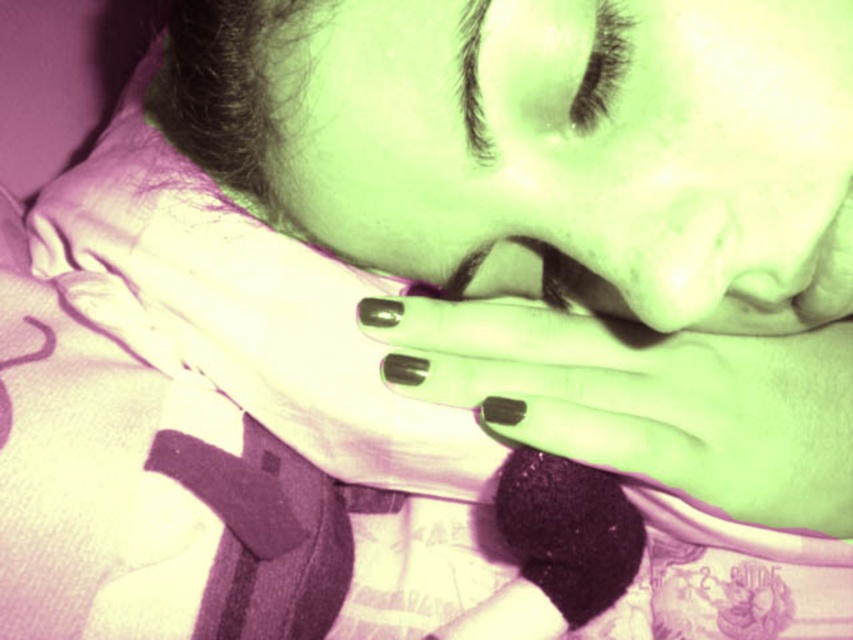
You are a photographer adjusting the lighting in the scene. You need to ensure that the matte green skin at center is properly lit. Where should you position your light source relative to the person?

The matte green skin at center is located at point [584,147], so position the light source at that coordinate to ensure proper lighting.

You are designing a small sculpture that needs to fit between the matte green skin at center and the matte black nails at center. The sculpture is 3 inches long. Will it fit in the space between them?

The space between the matte green skin at center and the matte black nails at center is only 2.68 inches, which is smaller than the 3 inches sculpture. Therefore, the sculpture will not fit between them.

You are a photographer adjusting lighting for a portrait. You notice the matte green skin at center and the black eyelashes at upper center. Which object requires more precise lighting adjustments to ensure its details are visible?

The matte green skin at center requires more precise lighting adjustments because its width surpasses that of the black eyelashes at upper center, making it a larger area to focus on.